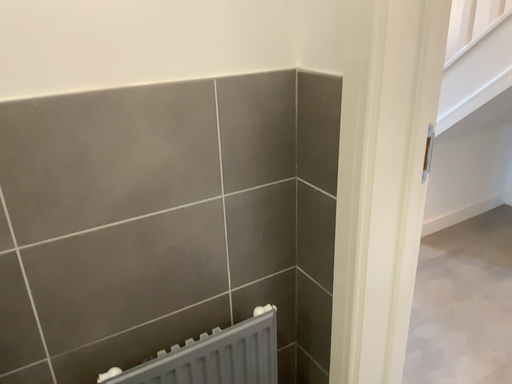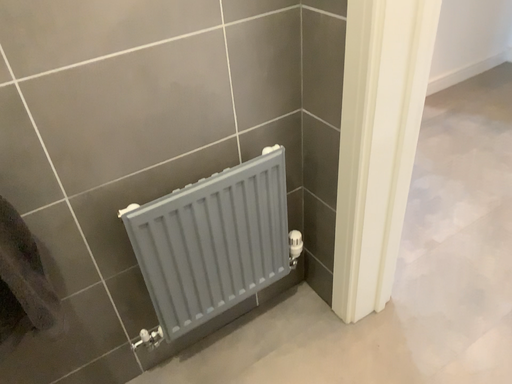
Question: How did the camera likely rotate when shooting the video?

Choices:
 (A) rotated downward
 (B) rotated upward

Answer: (A)